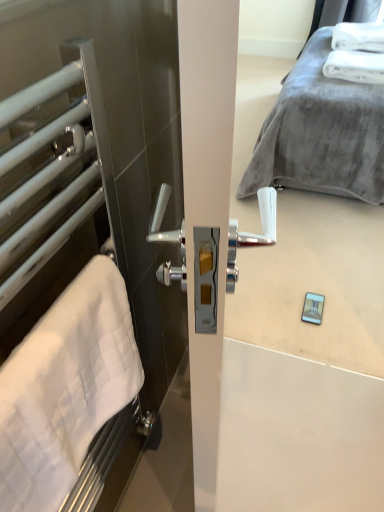
What is the approximate height of white soft towel at left, positioned as the second bath towel in back-to-front order?

It is 10.14 inches.

Image resolution: width=384 pixels, height=512 pixels. What are the coordinates of `velvet gray bed at upper right` in the screenshot? It's located at (321, 133).

In order to face white soft towel at upper right, arranged as the second bath towel when viewed from the front, should I rotate leftwards or rightwards?

You should look right and rotate roughly 20.959 degrees.

The width and height of the screenshot is (384, 512). What do you see at coordinates (357, 53) in the screenshot?
I see `white soft towel at upper right, arranged as the second bath towel when viewed from the front` at bounding box center [357, 53].

Where is `white soft towel at left, acting as the first bath towel starting from the left`? white soft towel at left, acting as the first bath towel starting from the left is located at coordinates (65, 388).

Is velvet gray bed at upper right taller than white soft towel at upper right, the second bath towel viewed from the left?

Yes.

Considering the sizes of velvet gray bed at upper right and white soft towel at upper right, the 2th bath towel ordered from the bottom, in the image, is velvet gray bed at upper right wider or thinner than white soft towel at upper right, the 2th bath towel ordered from the bottom,?

velvet gray bed at upper right is wider than white soft towel at upper right, the 2th bath towel ordered from the bottom.

Is velvet gray bed at upper right aimed at white soft towel at upper right, the 1th bath towel positioned from the right?

No, velvet gray bed at upper right does not turn towards white soft towel at upper right, the 1th bath towel positioned from the right.

Where is `bed in front of the white soft towel at upper right, arranged as the second bath towel when viewed from the front`? bed in front of the white soft towel at upper right, arranged as the second bath towel when viewed from the front is located at coordinates (321, 133).

Can you tell me how much white matte towel rack at left and white soft towel at left, the 1th bath towel from the front, differ in facing direction?

white matte towel rack at left and white soft towel at left, the 1th bath towel from the front, are facing 0.00781 degrees away from each other.

Is white matte towel rack at left situated inside white soft towel at left, the second bath towel in the top-to-bottom sequence, or outside?

white matte towel rack at left is not inside white soft towel at left, the second bath towel in the top-to-bottom sequence, it's outside.

Is white matte towel rack at left shorter than white soft towel at left, the 1th bath towel from the front?

In fact, white matte towel rack at left may be taller than white soft towel at left, the 1th bath towel from the front.

Considering the relative positions of white matte towel rack at left and white soft towel at left, acting as the first bath towel starting from the left, in the image provided, is white matte towel rack at left to the left or to the right of white soft towel at left, acting as the first bath towel starting from the left,?

Based on their positions, white matte towel rack at left is located to the left of white soft towel at left, acting as the first bath towel starting from the left.

Which of these two, white matte towel rack at left or velvet gray bed at upper right, stands taller?

white matte towel rack at left.

Is velvet gray bed at upper right at the back of white matte towel rack at left?

That's not correct — white matte towel rack at left is not looking away from velvet gray bed at upper right.

Does white matte towel rack at left have a smaller size compared to velvet gray bed at upper right?

Yes.

Is white matte towel rack at left directly adjacent to velvet gray bed at upper right?

No.

Considering the sizes of objects white soft towel at left, positioned as the second bath towel in right-to-left order, and white soft towel at upper right, the 1th bath towel positioned from the right, in the image provided, who is shorter, white soft towel at left, positioned as the second bath towel in right-to-left order, or white soft towel at upper right, the 1th bath towel positioned from the right,?

white soft towel at upper right, the 1th bath towel positioned from the right, is shorter.

Do you think white soft towel at left, the 1th bath towel from the front, is within white soft towel at upper right, arranged as the second bath towel when viewed from the front, or outside of it?

white soft towel at left, the 1th bath towel from the front, is not inside white soft towel at upper right, arranged as the second bath towel when viewed from the front, it's outside.

Considering the relative sizes of white soft towel at left, acting as the first bath towel starting from the left, and white soft towel at upper right, the 2th bath towel ordered from the bottom, in the image provided, is white soft towel at left, acting as the first bath towel starting from the left, bigger than white soft towel at upper right, the 2th bath towel ordered from the bottom,?

No.

I want to click on bath towel to the left of white soft towel at upper right, positioned as the first bath towel in back-to-front order, so click(65, 388).

From the image's perspective, is white soft towel at upper right, the 2th bath towel ordered from the bottom, below white soft towel at left, acting as the first bath towel starting from the left?

No, from the image's perspective, white soft towel at upper right, the 2th bath towel ordered from the bottom, is not below white soft towel at left, acting as the first bath towel starting from the left.

How different are the orientations of white soft towel at upper right, arranged as the second bath towel when viewed from the front, and white soft towel at left, the second bath towel in the top-to-bottom sequence, in degrees?

176 degrees.

Locate an element on the screen. bath towel below the white matte towel rack at left (from the image's perspective) is located at coordinates (65, 388).

Between point (12, 472) and point (69, 169), which one is positioned behind?

Positioned behind is point (69, 169).

Is white soft towel at left, positioned as the second bath towel in right-to-left order, positioned behind white matte towel rack at left?

Yes.

Considering the positions of objects white soft towel at left, the second bath towel in the top-to-bottom sequence, and white matte towel rack at left in the image provided, who is more to the left, white soft towel at left, the second bath towel in the top-to-bottom sequence, or white matte towel rack at left?

Positioned to the left is white matte towel rack at left.

How different are the orientations of white soft towel at upper right, the second bath towel viewed from the left, and velvet gray bed at upper right in degrees?

The angle between the facing direction of white soft towel at upper right, the second bath towel viewed from the left, and the facing direction of velvet gray bed at upper right is 2.45 degrees.

Considering the sizes of objects white soft towel at upper right, arranged as the second bath towel when viewed from the front, and velvet gray bed at upper right in the image provided, who is thinner, white soft towel at upper right, arranged as the second bath towel when viewed from the front, or velvet gray bed at upper right?

Thinner between the two is white soft towel at upper right, arranged as the second bath towel when viewed from the front.

Considering the sizes of objects white soft towel at upper right, the second bath towel viewed from the left, and velvet gray bed at upper right in the image provided, who is taller, white soft towel at upper right, the second bath towel viewed from the left, or velvet gray bed at upper right?

With more height is velvet gray bed at upper right.

From the image's perspective, who appears lower, white soft towel at upper right, positioned as the first bath towel in back-to-front order, or velvet gray bed at upper right?

velvet gray bed at upper right is shown below in the image.

Identify the location of bath towel behind the velvet gray bed at upper right. This screenshot has height=512, width=384. (357, 53).

Which bath towel is the 1st one when counting from the right side of the white matte towel rack at left? Please provide its 2D coordinates.

[(65, 388)]

Estimate the real-world distances between objects in this image. Which object is closer to white soft towel at left, positioned as the second bath towel in back-to-front order, white soft towel at upper right, the second bath towel viewed from the left, or velvet gray bed at upper right?

Based on the image, velvet gray bed at upper right appears to be nearer to white soft towel at left, positioned as the second bath towel in back-to-front order.

When comparing their distances from velvet gray bed at upper right, does white matte towel rack at left or white soft towel at left, the second bath towel in the top-to-bottom sequence, seem closer?

white matte towel rack at left is positioned closer to the anchor velvet gray bed at upper right.

From the image, which object appears to be nearer to white soft towel at left, marked as the first bath towel in a bottom-to-top arrangement, white soft towel at upper right, the first bath towel positioned from the top, or white matte towel rack at left?

white matte towel rack at left lies closer to white soft towel at left, marked as the first bath towel in a bottom-to-top arrangement, than the other object.

Based on their spatial positions, is white soft towel at left, the second bath towel in the top-to-bottom sequence, or velvet gray bed at upper right closer to white matte towel rack at left?

Based on the image, white soft towel at left, the second bath towel in the top-to-bottom sequence, appears to be nearer to white matte towel rack at left.

Looking at the image, which one is located closer to white matte towel rack at left, white soft towel at upper right, the first bath towel positioned from the top, or velvet gray bed at upper right?

velvet gray bed at upper right.

Based on their spatial positions, is white matte towel rack at left or white soft towel at upper right, arranged as the second bath towel when viewed from the front, closer to velvet gray bed at upper right?

Based on the image, white soft towel at upper right, arranged as the second bath towel when viewed from the front, appears to be nearer to velvet gray bed at upper right.

Looking at the image, which one is located further to velvet gray bed at upper right, white soft towel at upper right, the 1th bath towel positioned from the right, or white soft towel at left, the second bath towel in the top-to-bottom sequence?

white soft towel at left, the second bath towel in the top-to-bottom sequence, is positioned further to the anchor velvet gray bed at upper right.

Estimate the real-world distances between objects in this image. Which object is further from white soft towel at upper right, the 1th bath towel positioned from the right, velvet gray bed at upper right or white matte towel rack at left?

white matte towel rack at left is positioned further to the anchor white soft towel at upper right, the 1th bath towel positioned from the right.

Where is `bath towel located between white matte towel rack at left and velvet gray bed at upper right in the depth direction`? bath towel located between white matte towel rack at left and velvet gray bed at upper right in the depth direction is located at coordinates (65, 388).

Locate an element on the screen. This screenshot has height=512, width=384. bed between white soft towel at left, acting as the first bath towel starting from the left, and white soft towel at upper right, positioned as the first bath towel in back-to-front order, from front to back is located at coordinates (321, 133).

The height and width of the screenshot is (512, 384). I want to click on bath towel between white matte towel rack at left and white soft towel at upper right, the first bath towel positioned from the top, in the front-back direction, so click(65, 388).

What are the coordinates of `bed located between white matte towel rack at left and white soft towel at upper right, the 1th bath towel positioned from the right, in the depth direction` in the screenshot? It's located at (321, 133).